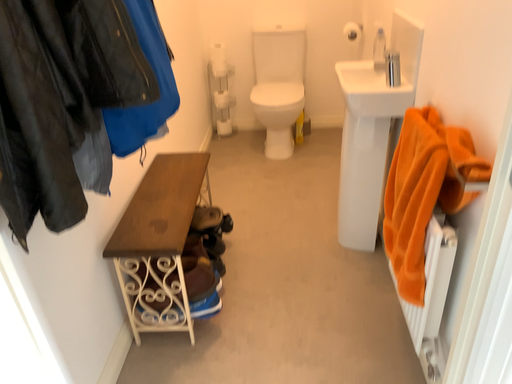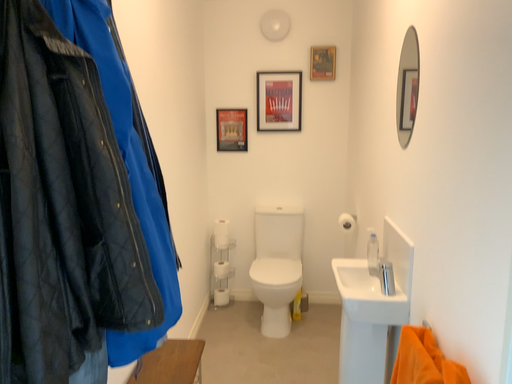
Question: How did the camera likely rotate when shooting the video?

Choices:
 (A) rotated downward
 (B) rotated upward

Answer: (B)